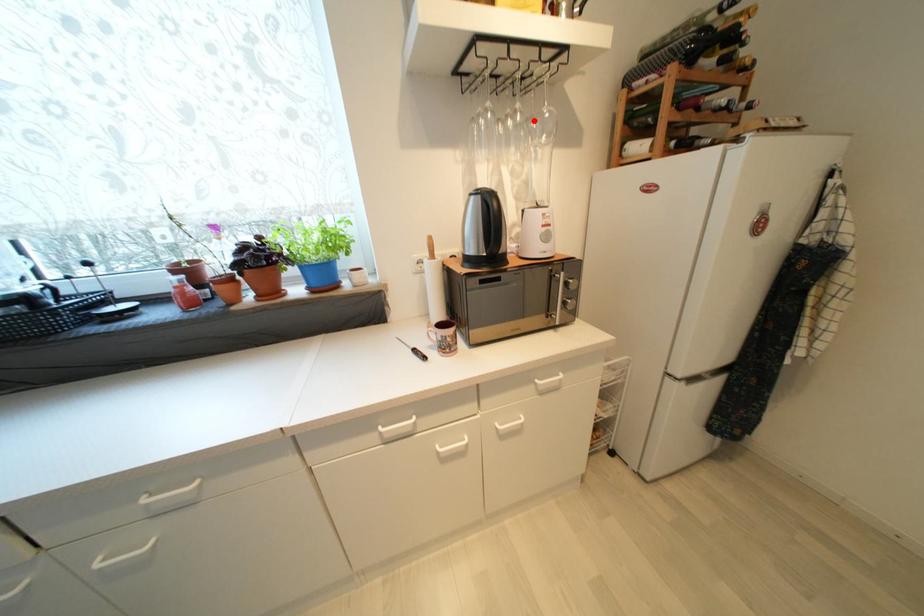
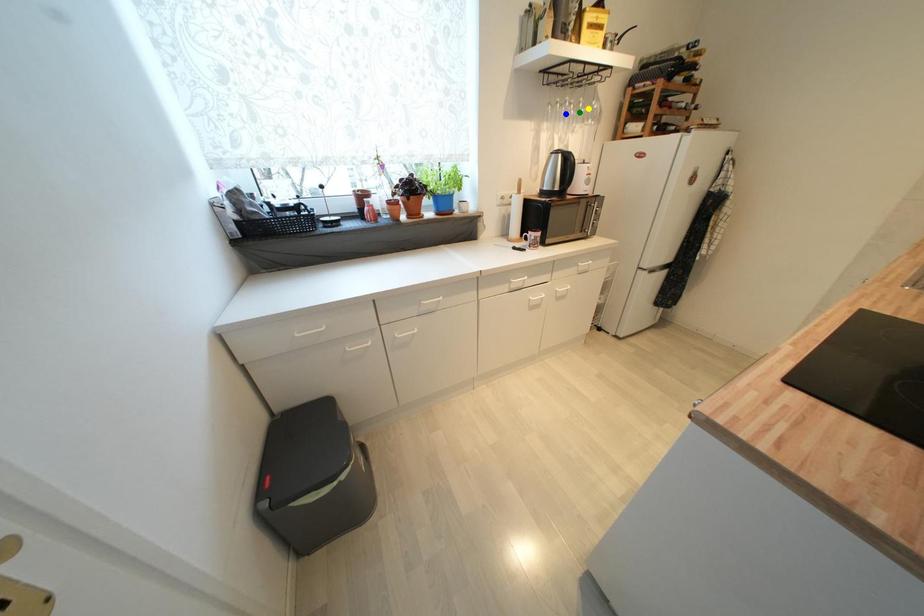
Question: I am providing you with two images of the same scene from different viewpoints. A red point is marked on the first image. You are given multiple points on the second image. Can you choose the point in image 2 that corresponds to the point in image 1?

Choices:
 (A) yellow point
 (B) green point
 (C) blue point

Answer: (A)